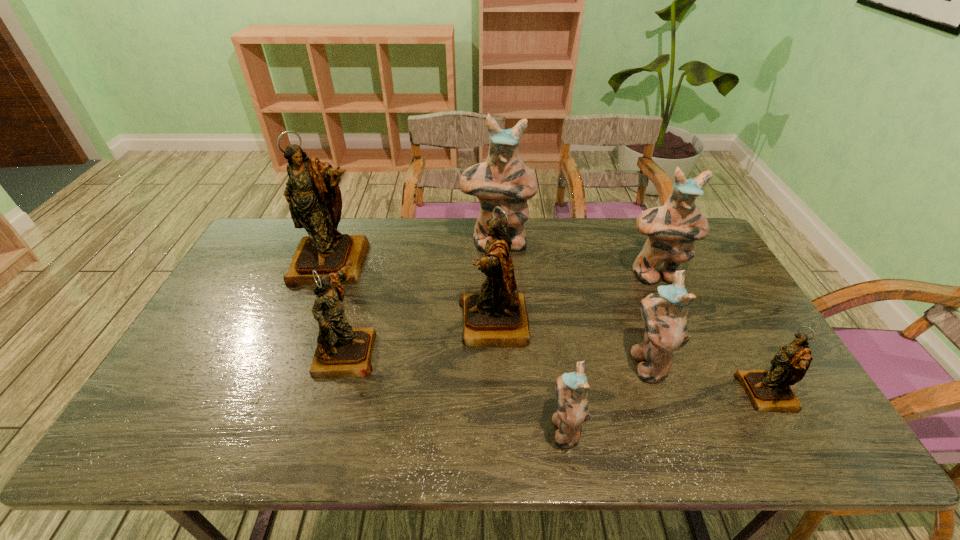
This screenshot has height=540, width=960. In order to click on free space located on the front-facing side of the smallest gold figurine in this screenshot , I will do `click(653, 393)`.

The width and height of the screenshot is (960, 540). I want to click on vacant region located on the front-facing side of the smallest pink figurine, so click(x=507, y=428).

Where is `free space located on the front-facing side of the smallest pink figurine`? This screenshot has width=960, height=540. free space located on the front-facing side of the smallest pink figurine is located at coordinates (502, 428).

Image resolution: width=960 pixels, height=540 pixels. I want to click on blank space located 0.260m on the front-facing side of the smallest pink figurine, so click(438, 428).

The image size is (960, 540). In order to click on object positioned at the near edge in this screenshot , I will do `click(571, 388)`.

In the image, there is a desktop. Identify the location of vacant space at the far edge. The width and height of the screenshot is (960, 540). (540, 247).

Locate an element on the screen. The image size is (960, 540). vacant space at the near edge of the desktop is located at coordinates (598, 448).

Where is `vacant space at the right edge`? Image resolution: width=960 pixels, height=540 pixels. vacant space at the right edge is located at coordinates (709, 288).

Image resolution: width=960 pixels, height=540 pixels. In the image, there is a desktop. Find the location of `vacant region at the far right corner`. vacant region at the far right corner is located at coordinates (698, 255).

This screenshot has height=540, width=960. What are the coordinates of `free space that is in between the farthest pink figurine and the biggest gold figurine` in the screenshot? It's located at (415, 253).